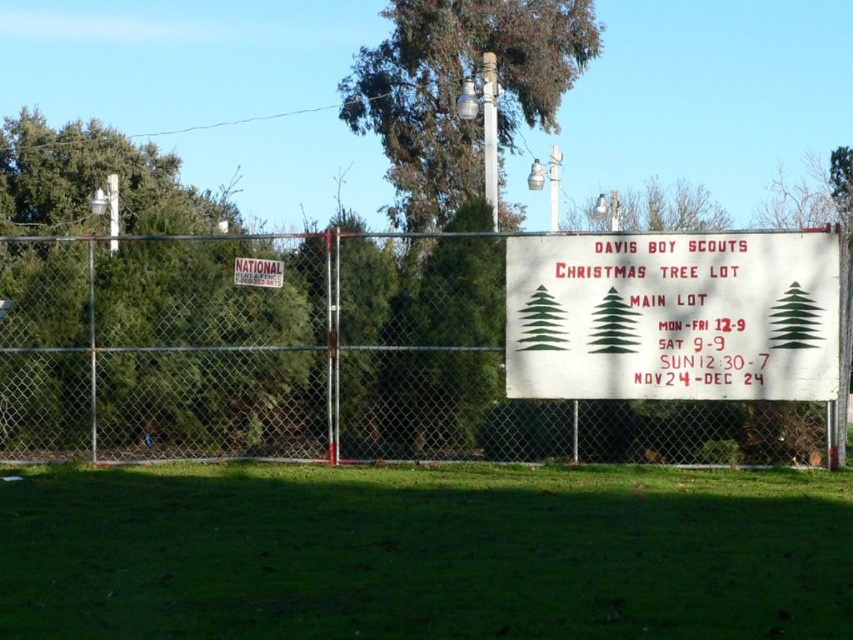
You are a visitor trying to find the entrance to the Christmas tree lot. You see the white metal fence at center and the green leafy tree at upper center. Which object is closer to the ground?

The white metal fence at center is closer to the ground because it is below the green leafy tree at upper center.

You are a visitor at the Davis Boy Scouts Christmas tree lot. You see the green grass at lower center and the white paper sign at center. Which area takes up more space in the image?

The white paper sign at center occupies more space than the green grass at lower center.